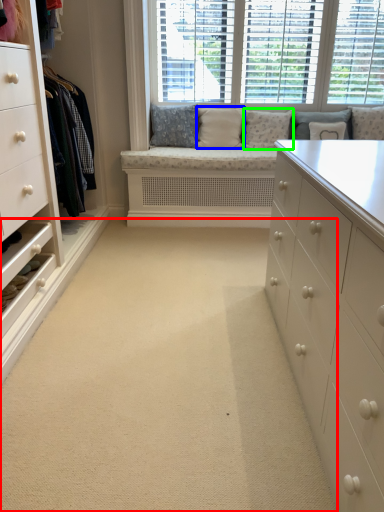
Question: Which object is positioned closest to plain (highlighted by a red box)? Select from pillow (highlighted by a blue box) and pillow (highlighted by a green box).

Choices:
 (A) pillow
 (B) pillow

Answer: (B)